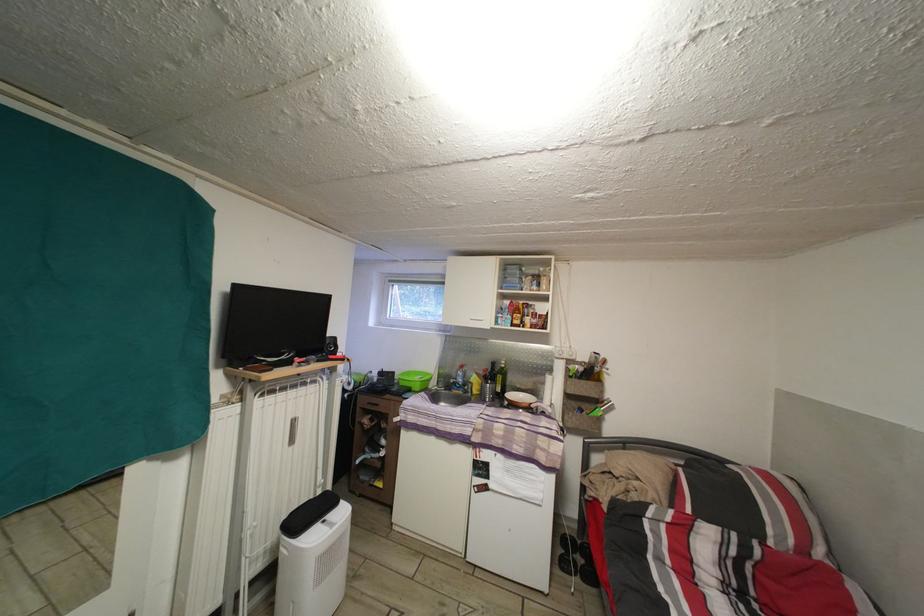
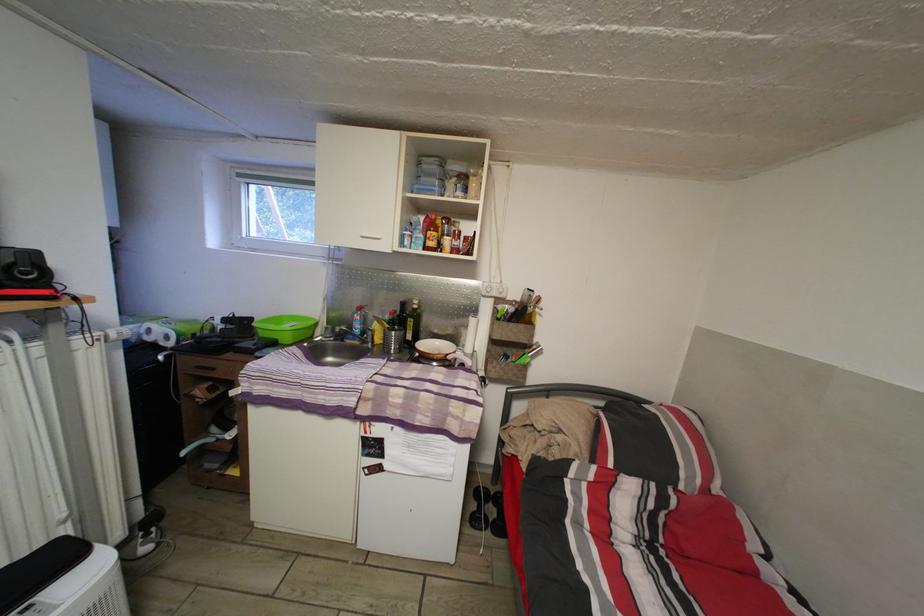
In the second image, find the point that corresponds to (399,379) in the first image.

(257, 326)